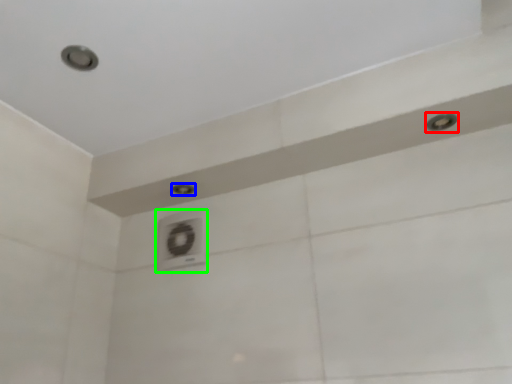
Question: Based on their relative distances, which object is nearer to shower (highlighted by a red box)? Choose from shower (highlighted by a blue box) and air conditioner (highlighted by a green box).

Choices:
 (A) shower
 (B) air conditioner

Answer: (A)